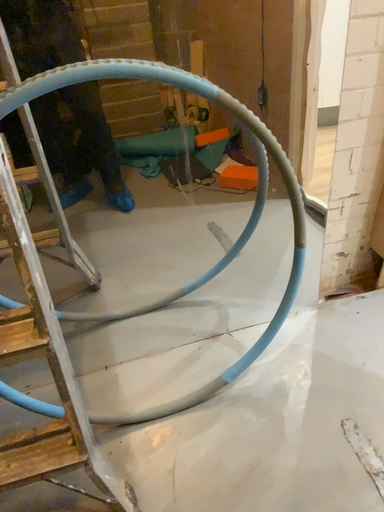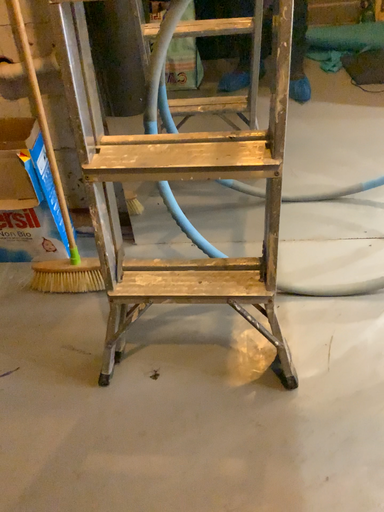
Question: How did the camera likely rotate when shooting the video?

Choices:
 (A) rotated upward
 (B) rotated downward

Answer: (B)